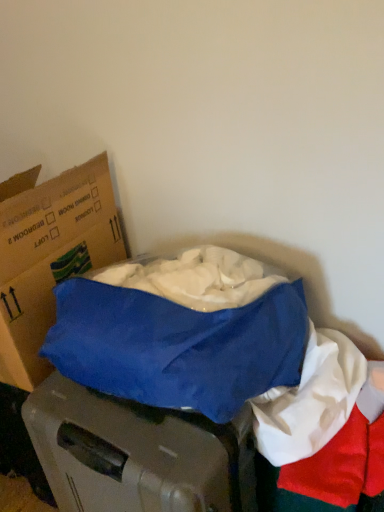
Question: Considering their positions, is blue fabric at center located in front of or behind cardboard box at left?

Choices:
 (A) front
 (B) behind

Answer: (A)

Question: Would you say blue fabric at center is to the left or to the right of cardboard box at left in the picture?

Choices:
 (A) left
 (B) right

Answer: (B)

Question: Is point (302, 410) closer or farther from the camera than point (39, 298)?

Choices:
 (A) farther
 (B) closer

Answer: (B)

Question: Considering the positions of cardboard box at left and blue fabric at center in the image, is cardboard box at left bigger or smaller than blue fabric at center?

Choices:
 (A) big
 (B) small

Answer: (A)

Question: Is cardboard box at left wider or thinner than blue fabric at center?

Choices:
 (A) thin
 (B) wide

Answer: (B)

Question: Do you think cardboard box at left is within blue fabric at center, or outside of it?

Choices:
 (A) outside
 (B) inside

Answer: (A)

Question: Is cardboard box at left to the left or to the right of blue fabric at center in the image?

Choices:
 (A) right
 (B) left

Answer: (B)